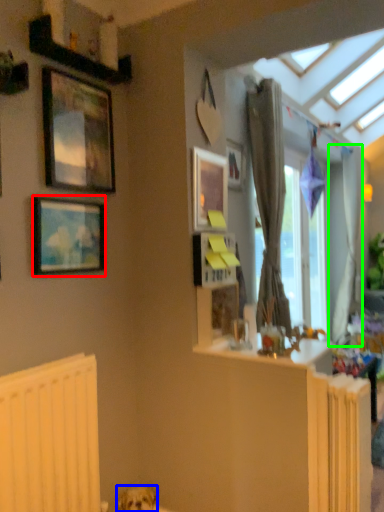
Question: Which object is positioned closest to picture frame (highlighted by a red box)? Select from dog (highlighted by a blue box) and curtain (highlighted by a green box).

Choices:
 (A) dog
 (B) curtain

Answer: (A)